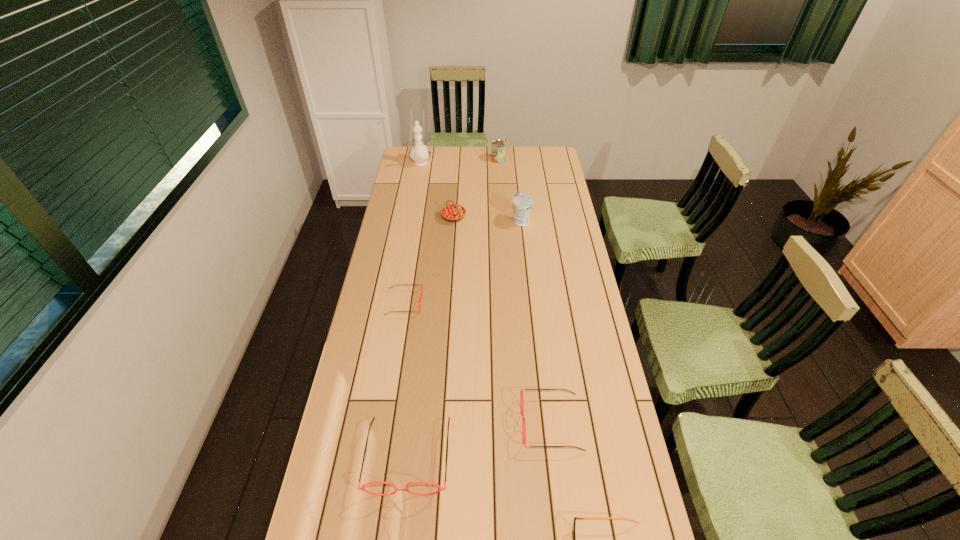
Locate an element on the screen. This screenshot has width=960, height=540. chinaware positioned at the left edge is located at coordinates (419, 153).

Find the location of a particular element. object that is at the right edge is located at coordinates (521, 398).

Locate an element on the screen. This screenshot has height=540, width=960. object that is at the far left corner is located at coordinates (419, 153).

Identify the location of free region at the left edge of the desktop. The height and width of the screenshot is (540, 960). (353, 355).

You are a GUI agent. You are given a task and a screenshot of the screen. Output one action in this format:
    pyautogui.click(x=<x>, y=<y>)
    Task: Click on the free point at the right edge
    The width and height of the screenshot is (960, 540).
    Given the screenshot: What is the action you would take?
    pyautogui.click(x=570, y=202)

This screenshot has height=540, width=960. Find the location of `free space between the strawberry and the tallest object`. free space between the strawberry and the tallest object is located at coordinates (437, 191).

At what (x,y) coordinates should I click in order to perform the action: click on free spot between the smallest red spectacles and the chinaware. Please return your answer as a coordinate pair (x, y). Looking at the image, I should click on (413, 233).

Find the location of `free spot between the second tallest object and the smallest red spectacles`. free spot between the second tallest object and the smallest red spectacles is located at coordinates (451, 232).

Where is `free space between the can and the biggest red spectacles`? free space between the can and the biggest red spectacles is located at coordinates (453, 308).

Where is `free space between the sixth tallest object and the tallest object`? This screenshot has height=540, width=960. free space between the sixth tallest object and the tallest object is located at coordinates (486, 293).